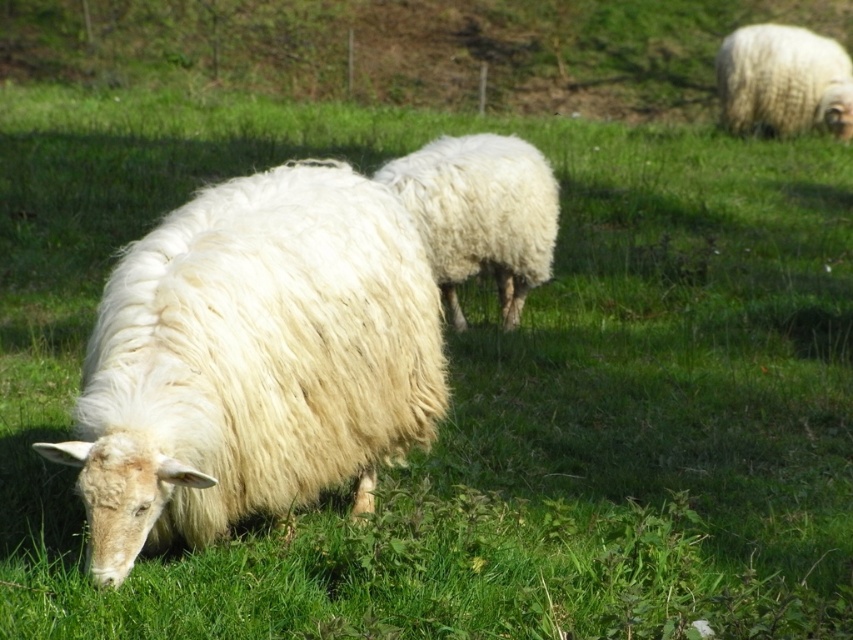
Question: Among these points, which one is farthest from the camera?

Choices:
 (A) (775, 76)
 (B) (212, 433)
 (C) (546, 234)

Answer: (A)

Question: Which is nearer to the white fluffy sheep at upper right?

Choices:
 (A) white fluffy sheep at center
 (B) white fluffy wool at center

Answer: (B)

Question: Can you confirm if white fluffy wool at center is positioned to the left of white fluffy sheep at upper right?

Choices:
 (A) yes
 (B) no

Answer: (A)

Question: Observing the image, what is the correct spatial positioning of white fluffy sheep at center in reference to white fluffy sheep at upper right?

Choices:
 (A) below
 (B) above

Answer: (A)

Question: Among these objects, which one is nearest to the camera?

Choices:
 (A) white fluffy sheep at upper right
 (B) white fluffy wool at center

Answer: (B)

Question: Observing the image, what is the correct spatial positioning of white fluffy sheep at center in reference to white fluffy sheep at upper right?

Choices:
 (A) left
 (B) right

Answer: (A)